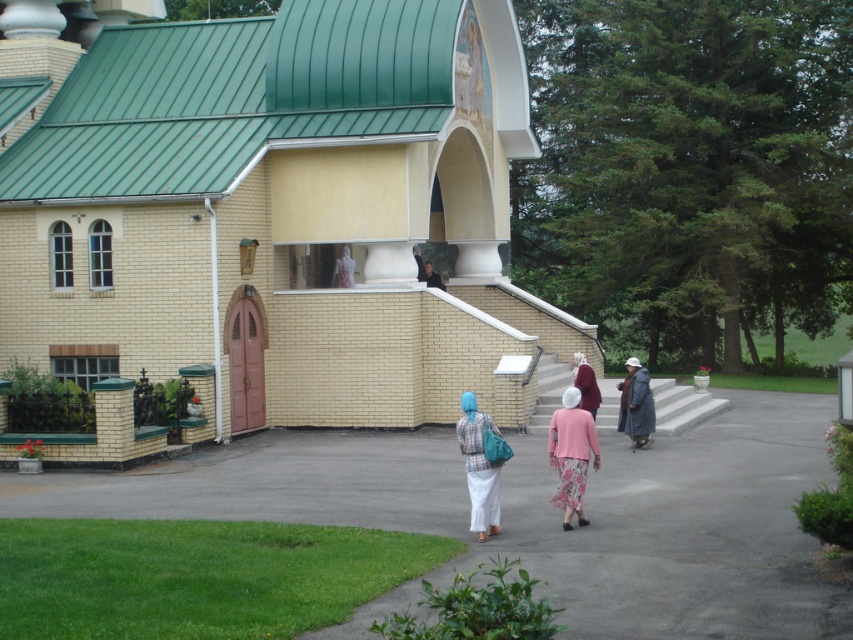
Question: Does gray woolen coat at lower right come in front of maroon fabric headscarf at center?

Choices:
 (A) yes
 (B) no

Answer: (A)

Question: Which is nearer to the smooth asphalt path at center?

Choices:
 (A) gray woolen coat at lower right
 (B) pink floral dress at center

Answer: (B)

Question: Is yellow brick church at center positioned in front of gray woolen coat at lower right?

Choices:
 (A) yes
 (B) no

Answer: (A)

Question: Which is farther from the gray woolen coat at lower right?

Choices:
 (A) dark brown leather jacket at upper center
 (B) plaid fabric dress at center
 (C) pink floral dress at center

Answer: (B)

Question: Among these objects, which one is nearest to the camera?

Choices:
 (A) dark brown leather jacket at upper center
 (B) plaid fabric dress at center

Answer: (B)

Question: Can you confirm if smooth asphalt path at center is bigger than dark brown leather jacket at upper center?

Choices:
 (A) yes
 (B) no

Answer: (A)